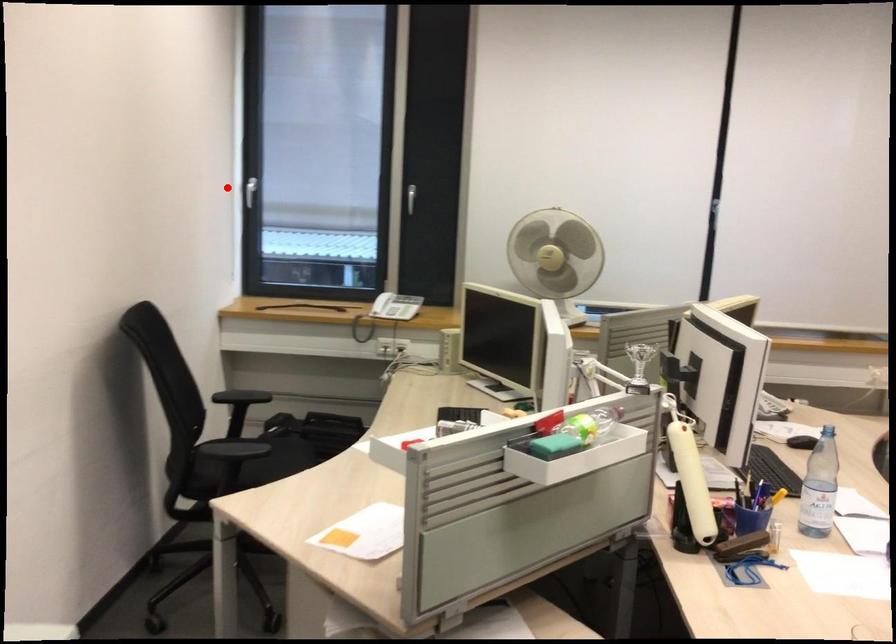
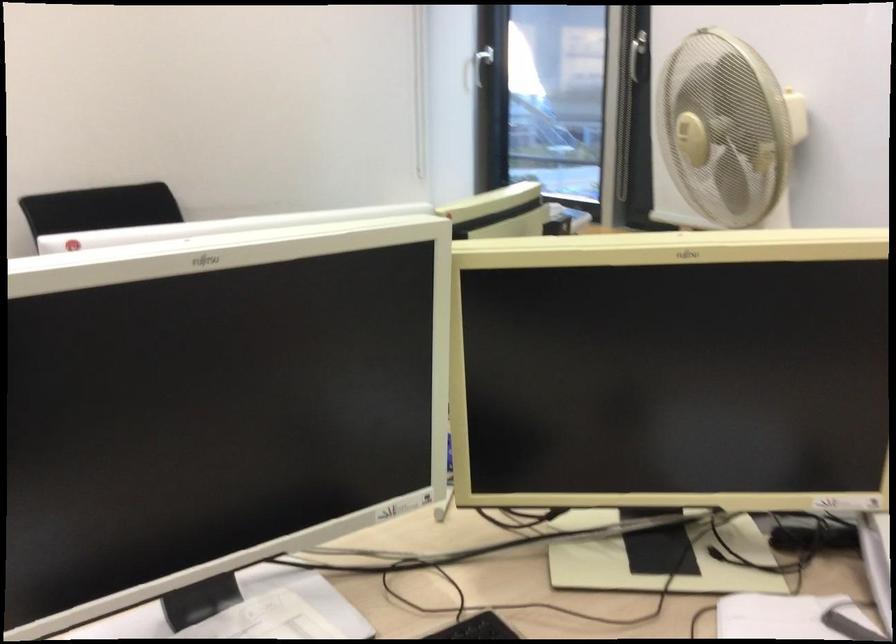
Question: I am providing you with two images of the same scene from different viewpoints. A red point is marked on the first image. At the location where the point appears in image 1, is it still visible in image 2?

Choices:
 (A) Yes
 (B) No

Answer: (A)